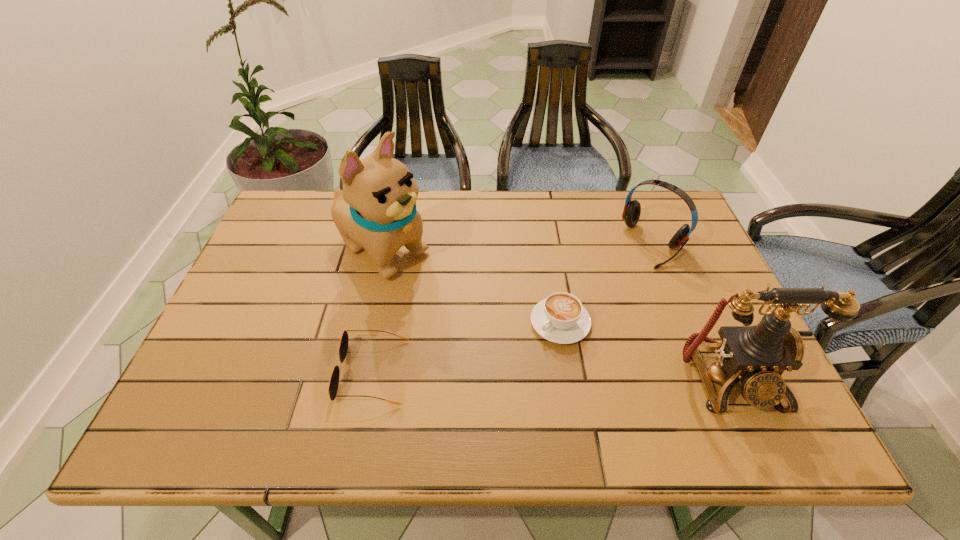
You are a GUI agent. You are given a task and a screenshot of the screen. Output one action in this format:
    pyautogui.click(x=<x>, y=<y>)
    Task: Click on the sunglasses
    
    Given the screenshot: What is the action you would take?
    pyautogui.click(x=344, y=342)

I want to click on the fourth shortest object, so click(x=758, y=355).

I want to click on the tallest object, so click(376, 210).

Locate an element on the screen. Image resolution: width=960 pixels, height=540 pixels. headset is located at coordinates pyautogui.click(x=632, y=209).

In order to click on cappuccino in this screenshot , I will do `click(560, 318)`.

What are the coordinates of `free space located on the front-facing side of the sunglasses` in the screenshot? It's located at (227, 372).

Find the location of a particular element. vacant position located on the front-facing side of the sunglasses is located at coordinates (268, 372).

You are a GUI agent. You are given a task and a screenshot of the screen. Output one action in this format:
    pyautogui.click(x=<x>, y=<y>)
    Task: Click on the free space located 0.110m on the front-facing side of the sunglasses
    This screenshot has height=540, width=960.
    Given the screenshot: What is the action you would take?
    pyautogui.click(x=290, y=372)

Image resolution: width=960 pixels, height=540 pixels. I want to click on free space located on the face of the tallest object, so click(x=532, y=345).

The image size is (960, 540). Identify the location of free space located on the face of the tallest object. click(515, 334).